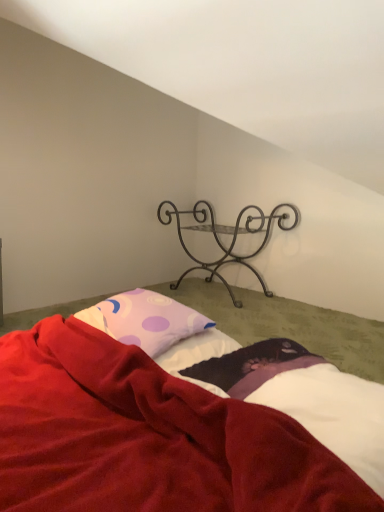
Question: Would you say purple dotted pillow at center is to the left or to the right of white soft sheet at lower right in the picture?

Choices:
 (A) left
 (B) right

Answer: (A)

Question: Is point (137, 307) closer or farther from the camera than point (283, 337)?

Choices:
 (A) closer
 (B) farther

Answer: (B)

Question: Which is nearer to the white soft sheet at lower right?

Choices:
 (A) purple dotted pillow at center
 (B) metallic wrought iron shelf at upper center
 (C) velvet red blanket at lower center

Answer: (C)

Question: Which of these objects is positioned closest to the velvet red blanket at lower center?

Choices:
 (A) white soft sheet at lower right
 (B) metallic wrought iron shelf at upper center
 (C) purple dotted pillow at center

Answer: (A)